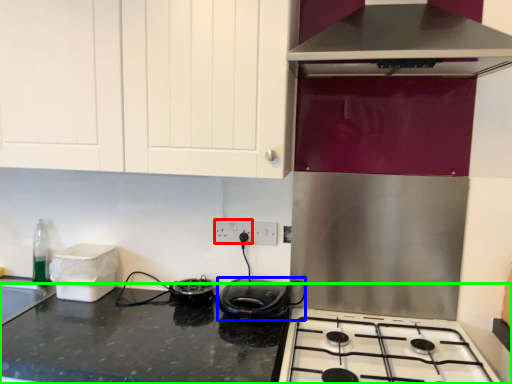
Question: Which object is the farthest from electric outlet (highlighted by a red box)? Choose among these: kitchen appliance (highlighted by a blue box) or countertop (highlighted by a green box).

Choices:
 (A) kitchen appliance
 (B) countertop

Answer: (B)